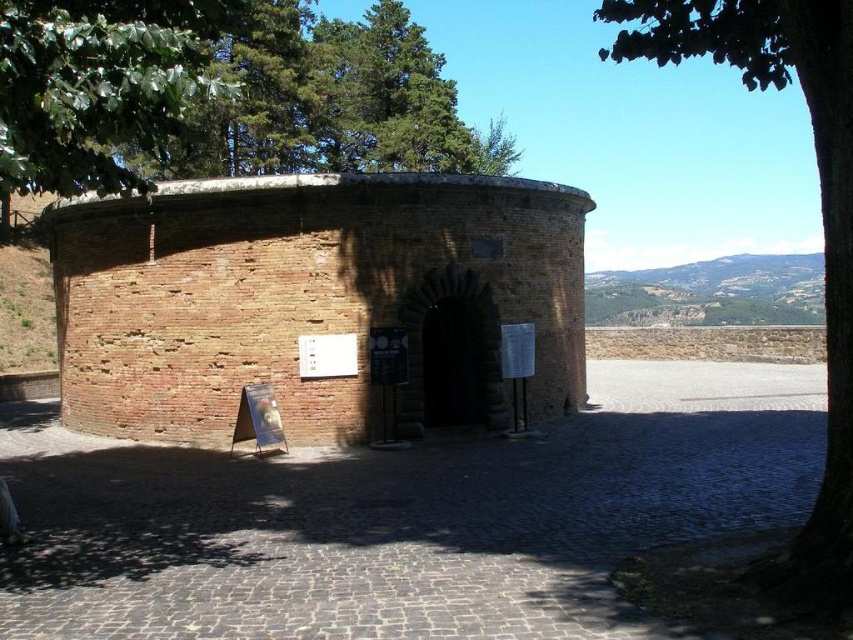
Is green leafy tree at upper right below dark brown stone arch at center?

No.

Between point (785, 68) and point (421, 275), which one is positioned behind?

The point (421, 275) is more distant.

Image resolution: width=853 pixels, height=640 pixels. Find the location of `green leafy tree at upper right`. green leafy tree at upper right is located at coordinates (820, 209).

Looking at this image, can you confirm if red brick fort at center is wider than dark brown stone arch at center?

Yes.

Is point (196, 371) farther from camera compared to point (473, 316)?

No, (196, 371) is in front of (473, 316).

Locate an element on the screen. The width and height of the screenshot is (853, 640). red brick fort at center is located at coordinates 312,300.

Which is above, green leafy tree at upper left or dark wood door at center?

green leafy tree at upper left is higher up.

I want to click on green leafy tree at upper left, so click(97, 86).